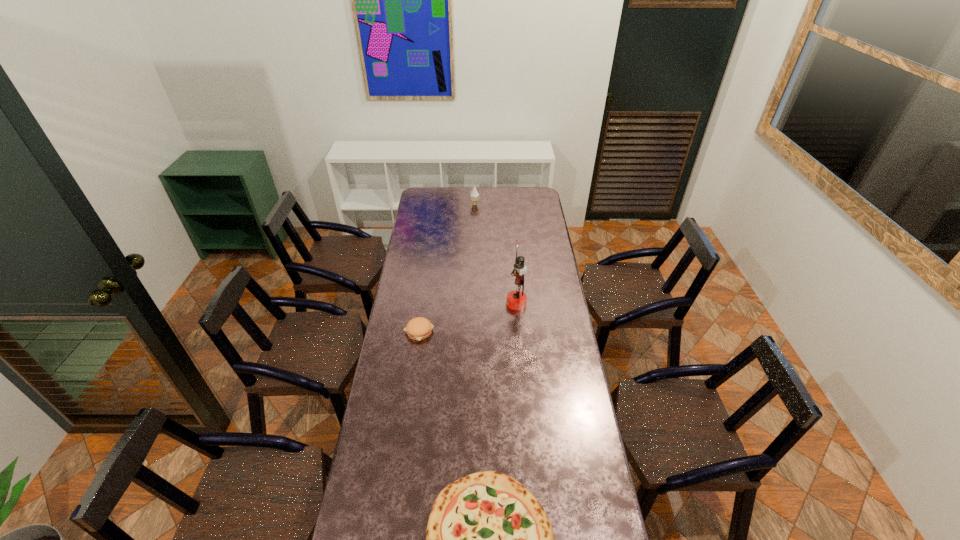
This screenshot has height=540, width=960. What are the coordinates of `the second farthest object` in the screenshot? It's located at (516, 300).

This screenshot has width=960, height=540. Identify the location of the tallest object. (516, 300).

Where is `the farthest object`? the farthest object is located at coordinates (474, 195).

Locate an element on the screen. Image resolution: width=960 pixels, height=540 pixels. the third shortest object is located at coordinates (474, 195).

Find the location of a particular element. This screenshot has height=540, width=960. the second nearest object is located at coordinates (419, 328).

Where is `the leftmost object`? This screenshot has width=960, height=540. the leftmost object is located at coordinates (419, 328).

At what (x,y) coordinates should I click in order to perform the action: click on free region located 0.290m on the front-facing side of the tallest object. Please return your answer as a coordinate pair (x, y). The width and height of the screenshot is (960, 540). Looking at the image, I should click on (446, 303).

At what (x,y) coordinates should I click in order to perform the action: click on free space located 0.150m on the front-facing side of the tallest object. Please return your answer as a coordinate pair (x, y). The width and height of the screenshot is (960, 540). Looking at the image, I should click on (475, 303).

Where is `vacant area located on the front-facing side of the tallest object`? This screenshot has height=540, width=960. vacant area located on the front-facing side of the tallest object is located at coordinates (446, 303).

Identify the location of free space located 0.080m on the front-facing side of the icecream. (492, 205).